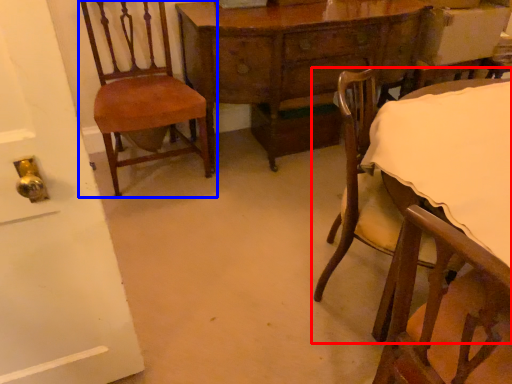
Question: Which object is closer to the camera taking this photo, chair (highlighted by a red box) or chair (highlighted by a blue box)?

Choices:
 (A) chair
 (B) chair

Answer: (A)